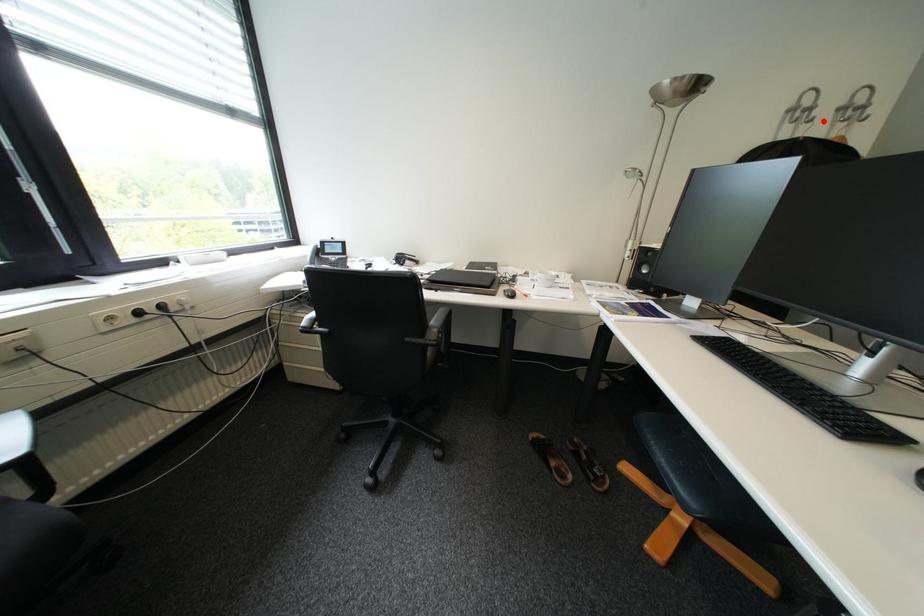
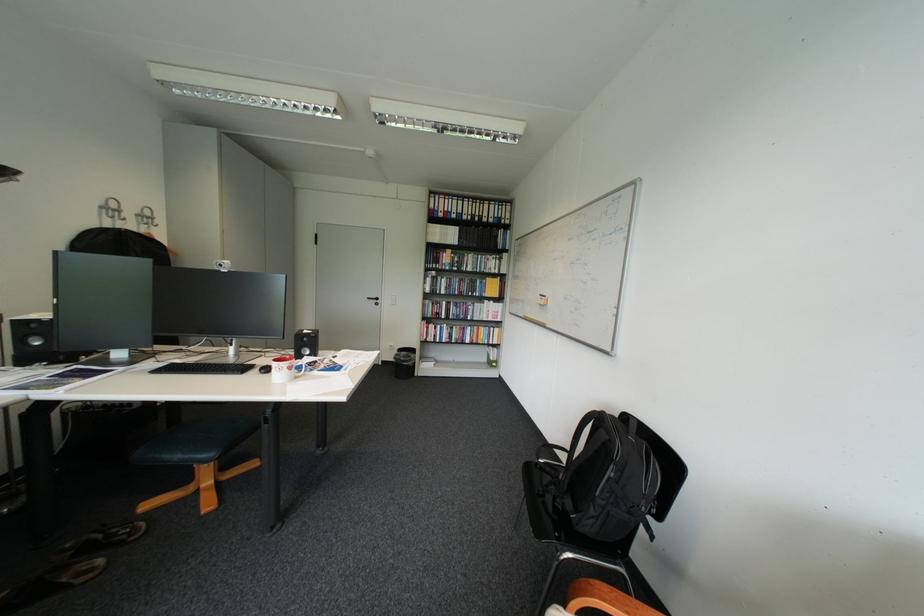
Locate, in the second image, the point that corresponds to the highlighted location in the first image.

(137, 220)